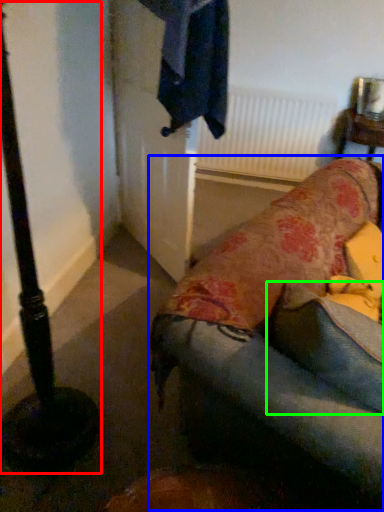
Question: Which object is the closest to the pole (highlighted by a red box)? Choose among these: studio couch (highlighted by a blue box) or pillow (highlighted by a green box).

Choices:
 (A) studio couch
 (B) pillow

Answer: (A)